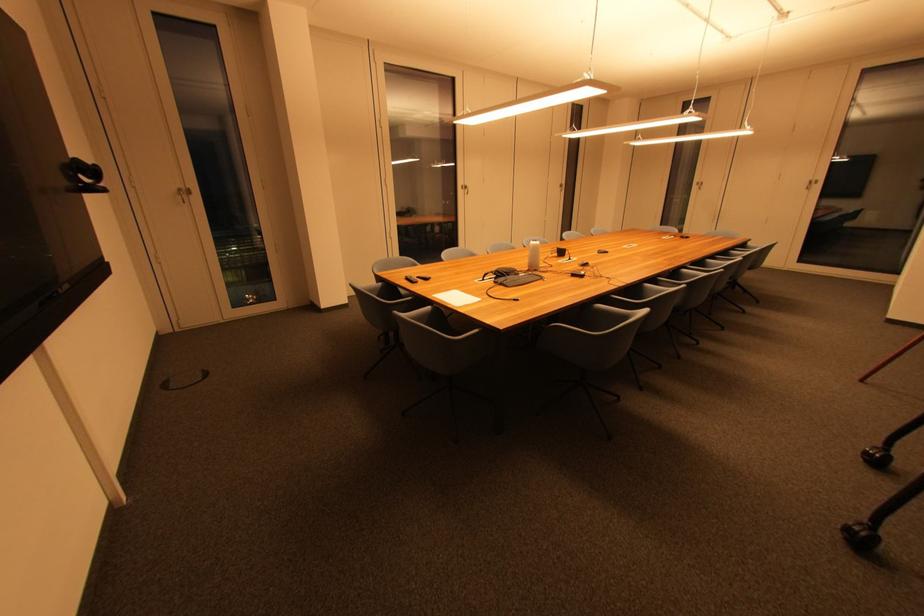
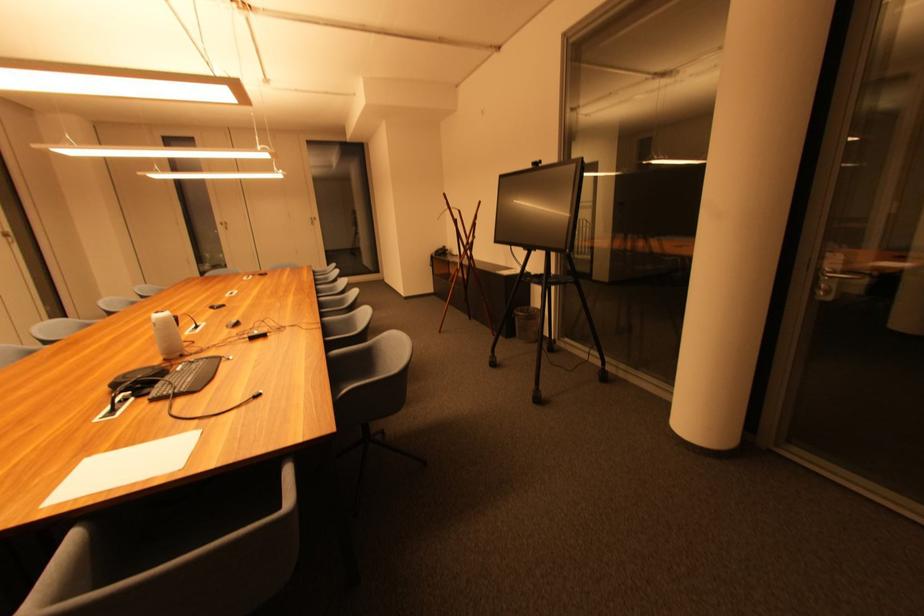
Find the pixel in the second image that matches point 623,289 in the first image.

(325, 331)